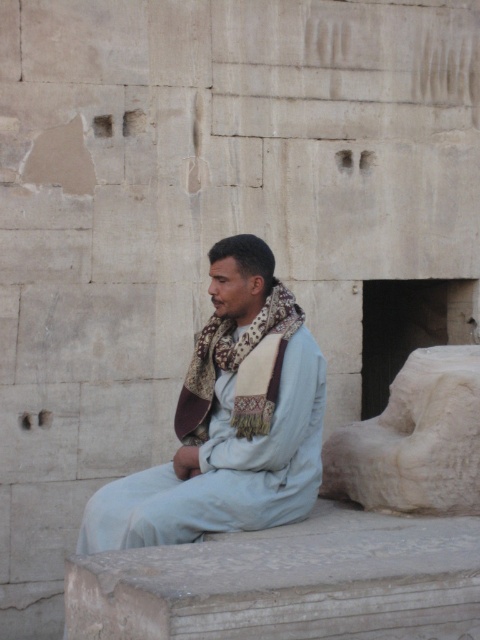
You are a tailor measuring fabrics for a new project. You see the smooth gray stone at lower center and the light blue fabric at center. Which object is wider?

The smooth gray stone at lower center might be wider than the light blue fabric at center according to the description.

You are standing in front of the wall and want to place a small potted plant between the smooth gray stone at lower center and the white stone statue at right. Based on their positions, where should you place the plant to ensure it is between them?

The smooth gray stone at lower center is below the white stone statue at right, so placing the plant between them would require positioning it above the smooth gray stone at lower center and below the white stone statue at right.